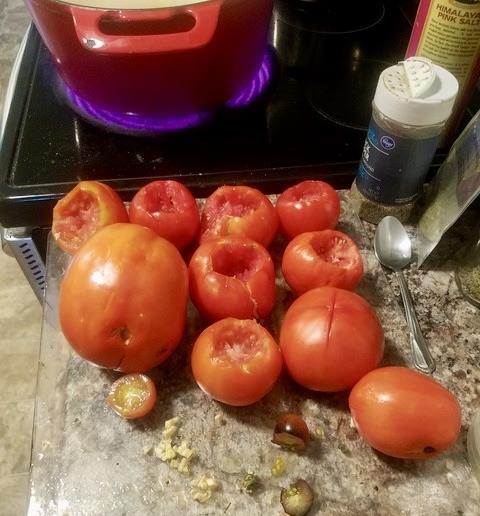
Image resolution: width=480 pixels, height=516 pixels. What are the coordinates of `pot` in the screenshot? It's located at (142, 99).